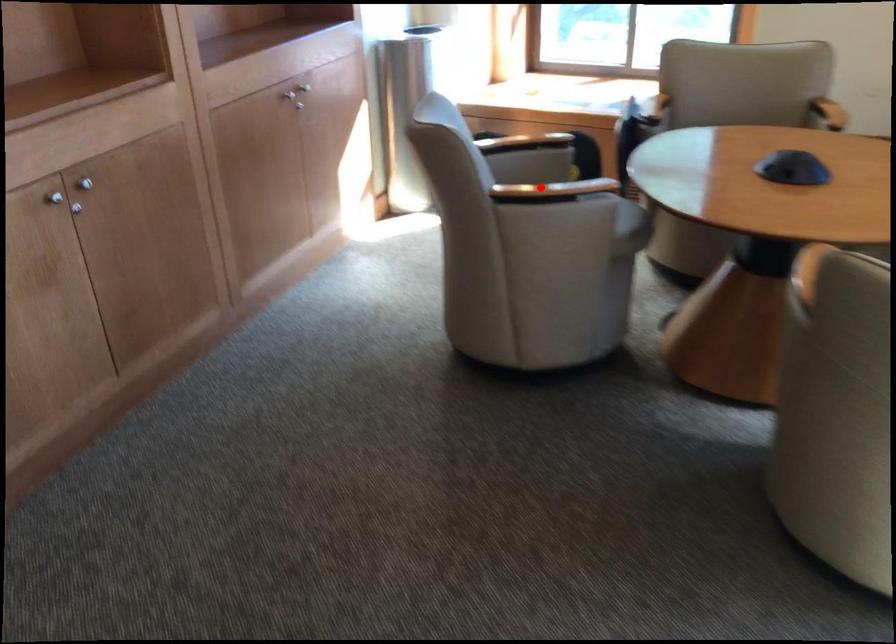
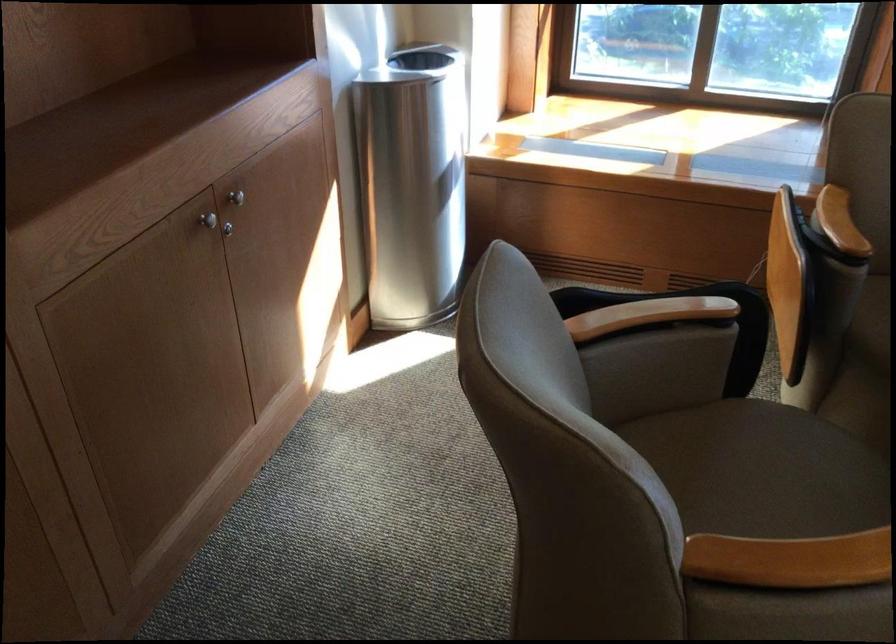
Find the pixel in the second image that matches the highlighted location in the first image.

(789, 560)